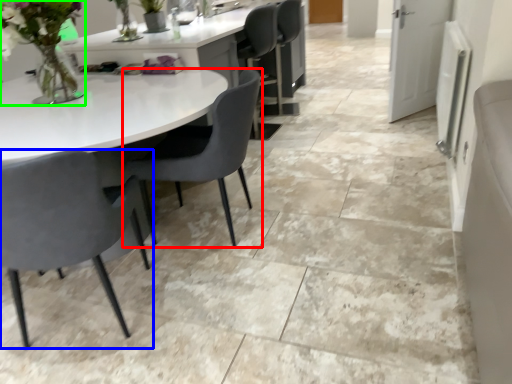
Question: Estimate the real-world distances between objects in this image. Which object is farther from chair (highlighted by a red box), chair (highlighted by a blue box) or floral arrangement (highlighted by a green box)?

Choices:
 (A) chair
 (B) floral arrangement

Answer: (B)